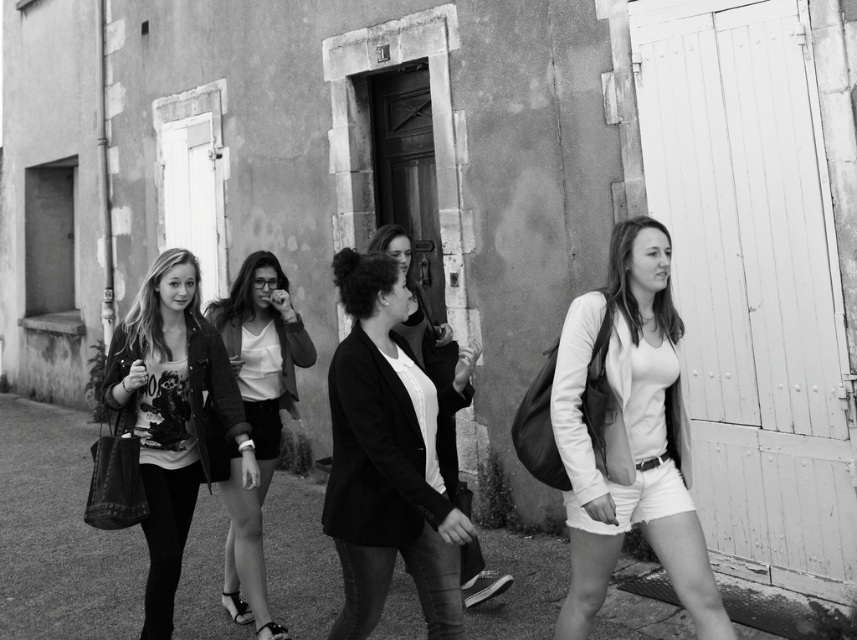
You are standing at the origin of the coordinate system in the image. You see two points, point (x=592, y=477) and point (x=408, y=472). Which point is closer to you?

Point (x=408, y=472) is closer to you because it is in front of point (x=592, y=477).